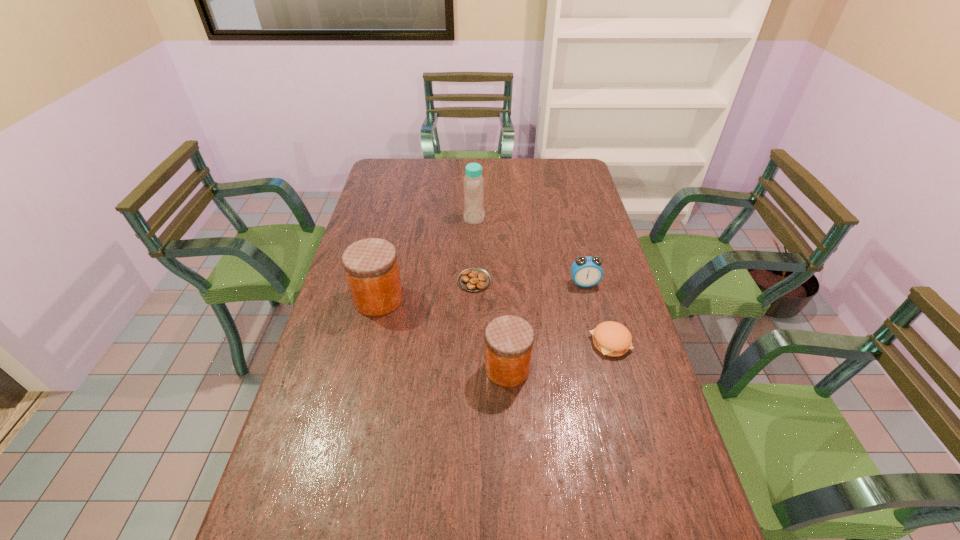
Where is `vacant region at the left edge of the desktop`? The width and height of the screenshot is (960, 540). vacant region at the left edge of the desktop is located at coordinates pos(326,446).

Locate an element on the screen. This screenshot has height=540, width=960. vacant space at the right edge of the desktop is located at coordinates (596, 364).

Locate an element on the screen. This screenshot has width=960, height=540. empty space that is in between the farther jar and the bottle is located at coordinates (426, 258).

Locate an element on the screen. This screenshot has width=960, height=540. blank region between the second shortest object and the shorter jar is located at coordinates (559, 355).

Identify the location of vacant area that lies between the patty and the farthest object. (542, 280).

This screenshot has height=540, width=960. Find the location of `free area in between the alarm clock and the farther jar`. free area in between the alarm clock and the farther jar is located at coordinates (482, 291).

Find the location of a particular element. empty location between the alarm clock and the leftmost object is located at coordinates click(x=482, y=291).

You are a GUI agent. You are given a task and a screenshot of the screen. Output one action in this format:
    pyautogui.click(x=<x>, y=<y>)
    Task: Click on the vacant area between the alarm clock and the fifth tallest object
    This screenshot has width=960, height=540.
    Given the screenshot: What is the action you would take?
    pyautogui.click(x=597, y=313)

Image resolution: width=960 pixels, height=540 pixels. Find the location of `free space between the shorter jar and the patty`. free space between the shorter jar and the patty is located at coordinates (559, 355).

Where is `empty space that is in between the tallest object and the third tallest object`? The height and width of the screenshot is (540, 960). empty space that is in between the tallest object and the third tallest object is located at coordinates point(491,293).